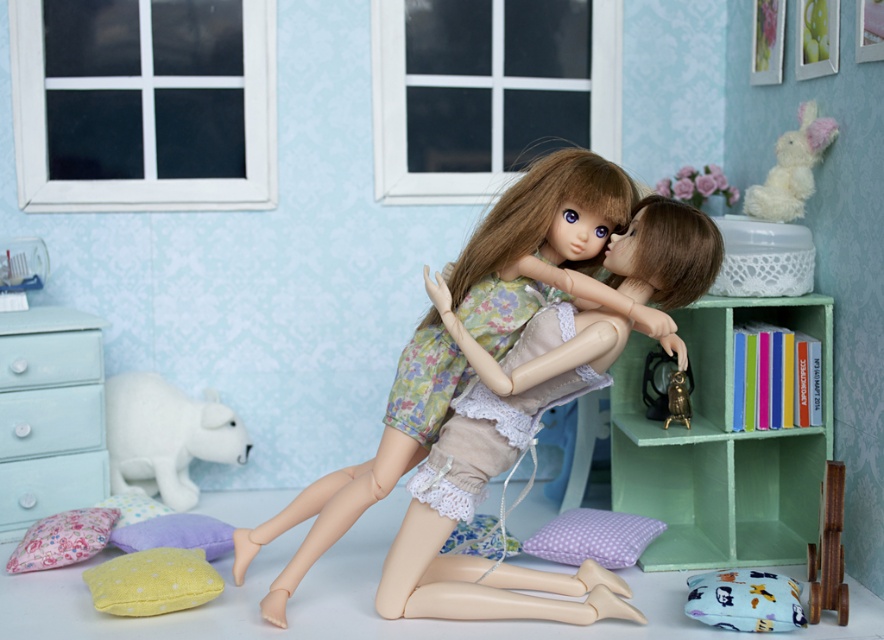
Question: Where is light blue felt dresser at left located in relation to floral fabric pillow at lower left in the image?

Choices:
 (A) right
 (B) left

Answer: (B)

Question: Among these points, which one is farthest from the camera?

Choices:
 (A) (501, 541)
 (B) (143, 598)
 (C) (28, 330)
 (D) (115, 496)

Answer: (D)

Question: Which of the following is the closest to the observer?

Choices:
 (A) (93, 476)
 (B) (37, 435)
 (C) (113, 502)
 (D) (595, 154)

Answer: (D)

Question: Can you confirm if fluffy white plush at upper right is positioned to the left of lace fabric pillow at lower center?

Choices:
 (A) no
 (B) yes

Answer: (A)

Question: Which of the following is the farthest from the observer?

Choices:
 (A) wooden frame at lower right
 (B) gold metallic statue at lower right
 (C) blue fabric pillow at lower right
 (D) matte light blue drawer at left

Answer: (D)

Question: Considering the relative positions of light blue felt dresser at left and gold metallic statue at lower right in the image provided, where is light blue felt dresser at left located with respect to gold metallic statue at lower right?

Choices:
 (A) above
 (B) below

Answer: (B)